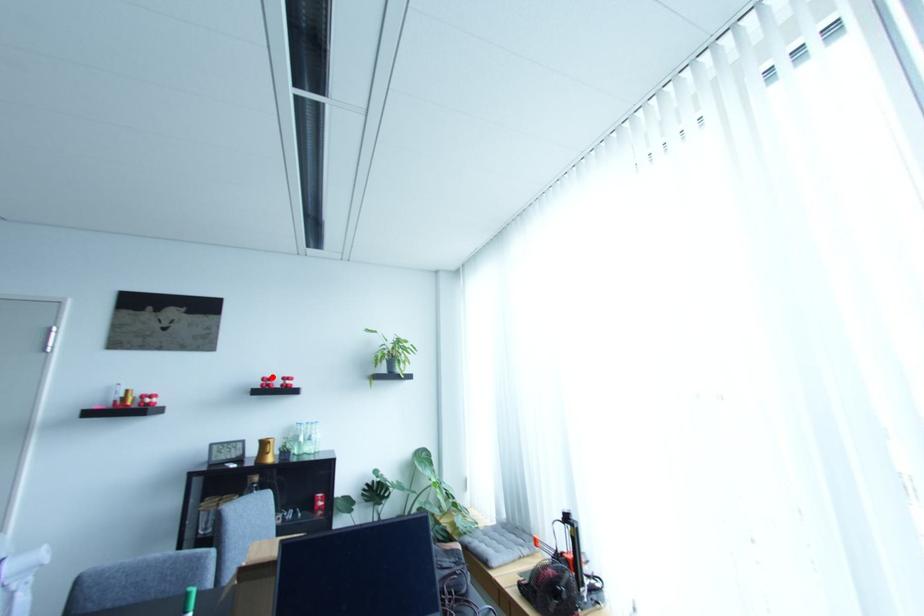
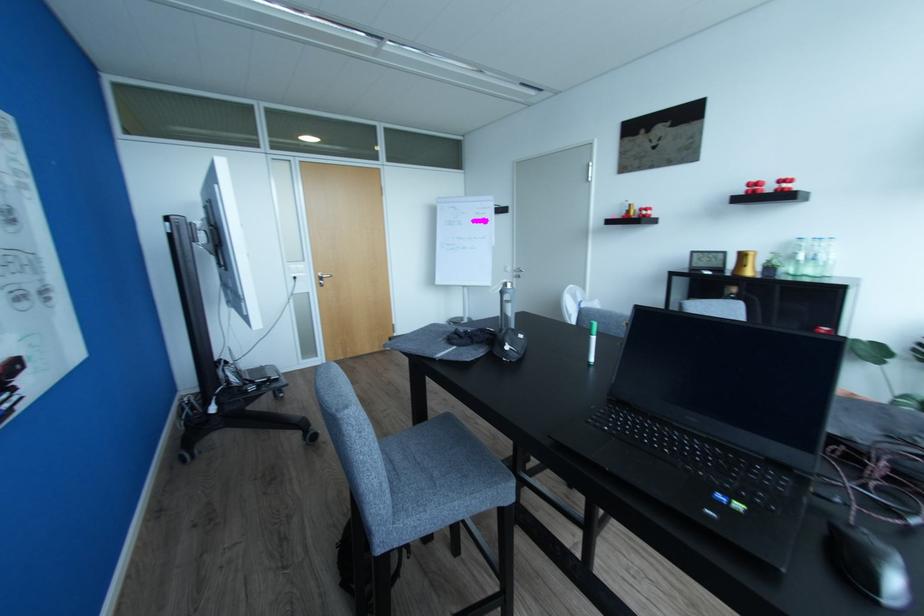
In the second image, find the point that corresponds to the highlighted location in the first image.

(760, 180)